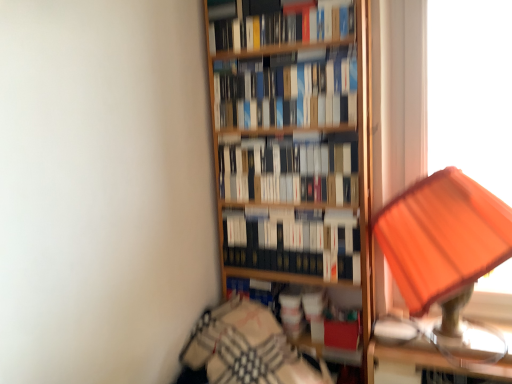
You are a GUI agent. You are given a task and a screenshot of the screen. Output one action in this format:
    pyautogui.click(x=<x>, y=<y>)
    Task: Click on the free region under hardcover books at center, which is the second book in top-to-bottom order (from a real-world perspective)
    The width and height of the screenshot is (512, 384).
    Given the screenshot: What is the action you would take?
    pyautogui.click(x=287, y=129)